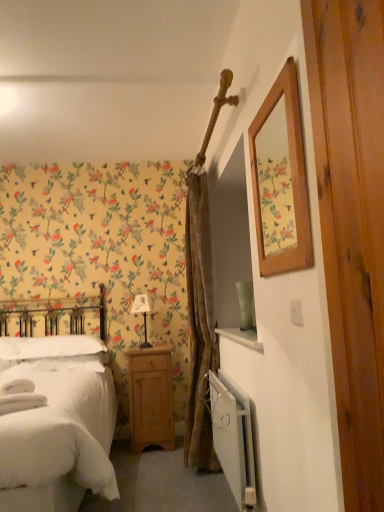
Locate an element on the screen. This screenshot has width=384, height=512. vacant area situated below brown textured curtain at center (from a real-world perspective) is located at coordinates (200, 481).